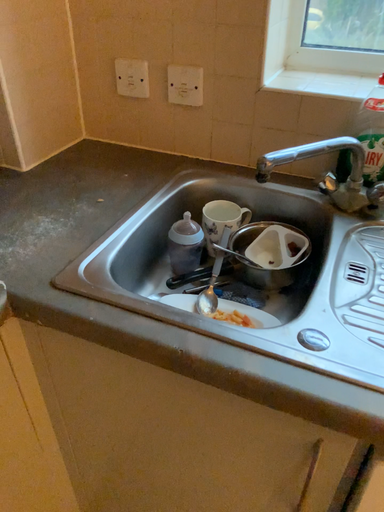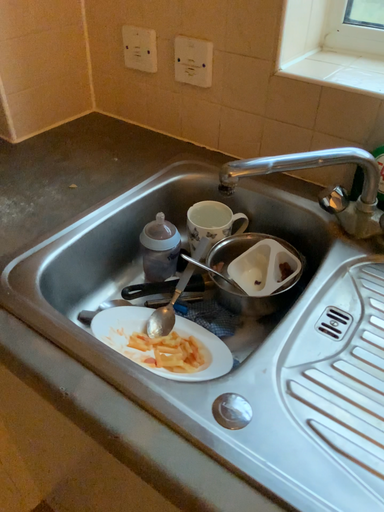
Question: Which way did the camera rotate in the video?

Choices:
 (A) rotated right
 (B) rotated left

Answer: (B)